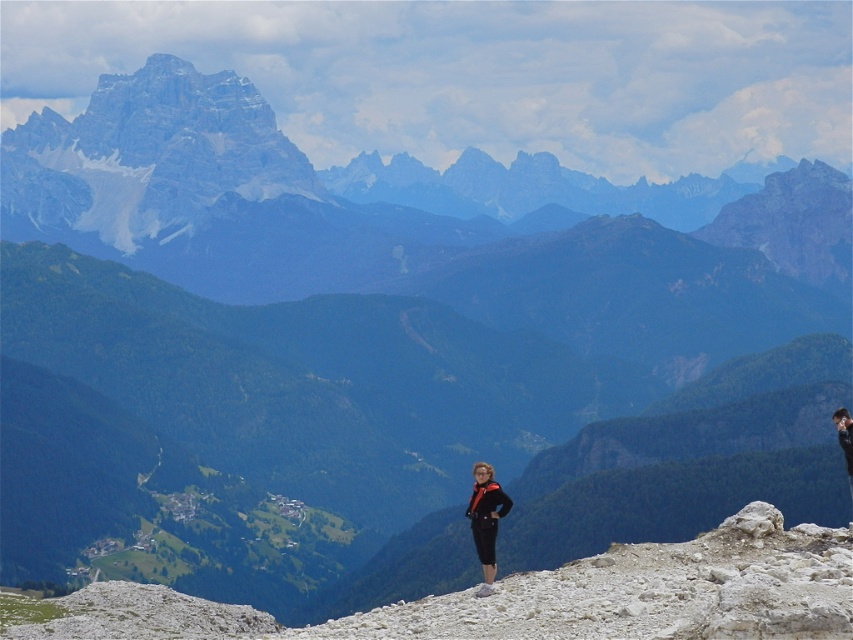
You are a hiker standing at the base of the rocky mountain range at upper left and the matte black pants at center. Which object is higher in elevation?

The rocky mountain range at upper left is taller than the matte black pants at center, so it has higher elevation.